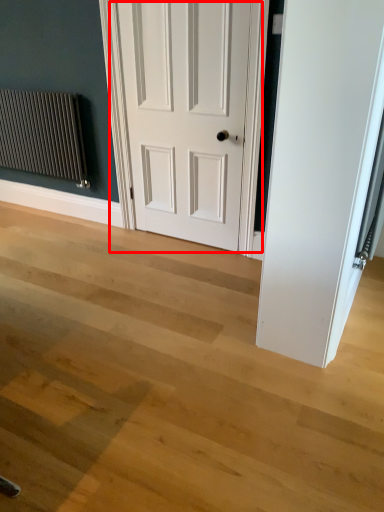
Question: Observing the image, what is the correct spatial positioning of door (annotated by the red box) in reference to radiator?

Choices:
 (A) left
 (B) right

Answer: (B)